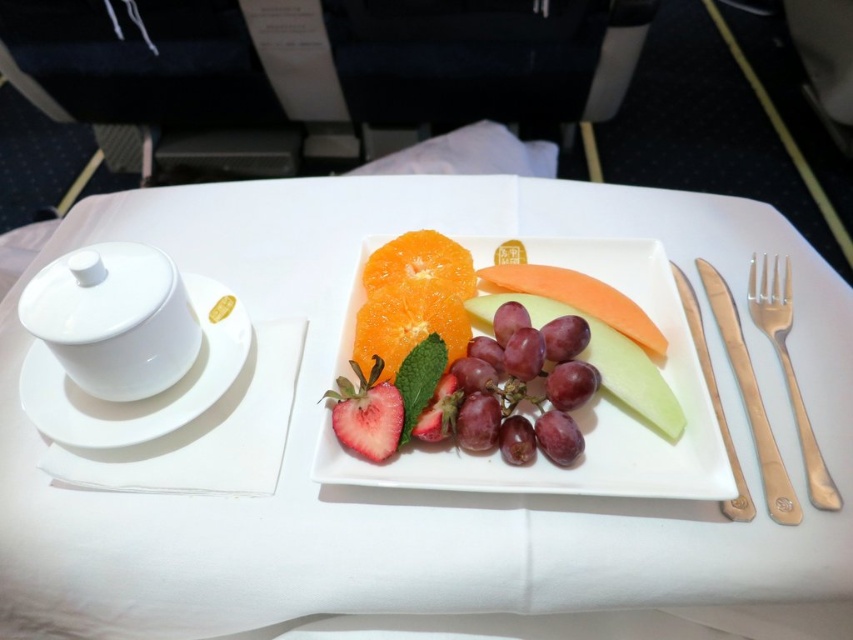
Question: Is gold metallic fork at right thinner than red matte strawberry at center?

Choices:
 (A) yes
 (B) no

Answer: (A)

Question: Can you confirm if glossy ceramic platter at center is thinner than red matte strawberry at center?

Choices:
 (A) no
 (B) yes

Answer: (A)

Question: Based on their relative distances, which object is nearer to the glossy ceramic platter at center?

Choices:
 (A) orange flesh at center
 (B) red matte strawberry at center
 (C) white porcelain plate at center

Answer: (C)

Question: Which object is closer to the camera taking this photo?

Choices:
 (A) orange flesh at center
 (B) purple matte grapes at center
 (C) white porcelain plate at center
 (D) gold metallic fork at right

Answer: (C)

Question: Among these objects, which one is nearest to the camera?

Choices:
 (A) white porcelain plate at center
 (B) orange flesh at center
 (C) glossy ceramic platter at center
 (D) red matte strawberry at center

Answer: (A)

Question: Is white porcelain plate at center thinner than white ceramic saucer at left?

Choices:
 (A) yes
 (B) no

Answer: (B)